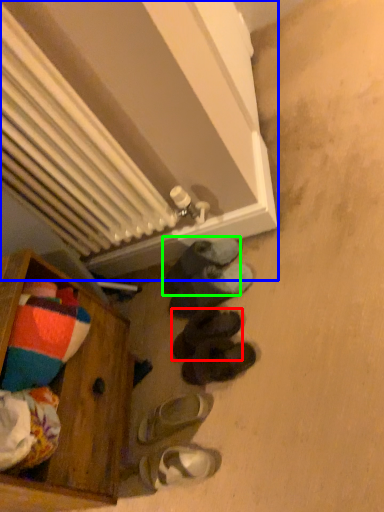
Question: Which object is the closest to the footwear (highlighted by a red box)? Choose among these: radiator (highlighted by a blue box) or footwear (highlighted by a green box).

Choices:
 (A) radiator
 (B) footwear

Answer: (B)